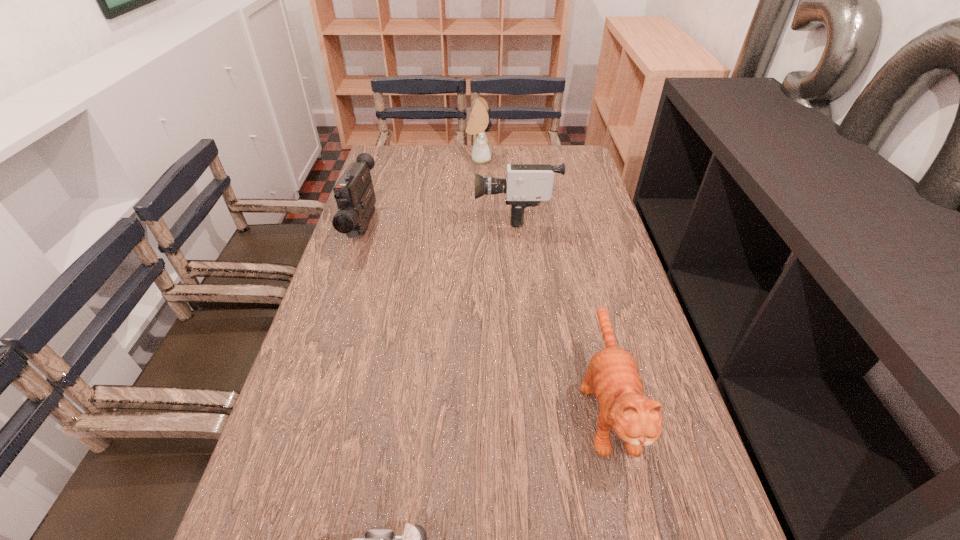
Find the location of a particular element. Image resolution: width=960 pixels, height=540 pixels. empty location between the rightmost camcorder and the leftmost object is located at coordinates (439, 220).

Find the location of a particular element. The width and height of the screenshot is (960, 540). vacant area that lies between the farthest object and the cat is located at coordinates (542, 281).

Identify the location of vacant point located between the leftmost camcorder and the rightmost camcorder. This screenshot has height=540, width=960. click(x=439, y=220).

Locate an element on the screen. The image size is (960, 540). vacant region between the cat and the leftmost camcorder is located at coordinates (485, 315).

Identify the location of unoccupied area between the farthest object and the cat. Image resolution: width=960 pixels, height=540 pixels. (542, 281).

I want to click on object that is the closest to the rightmost camcorder, so pyautogui.click(x=477, y=125).

Where is `object that stands as the fourth closest to the rightmost camcorder`? Image resolution: width=960 pixels, height=540 pixels. object that stands as the fourth closest to the rightmost camcorder is located at coordinates (414, 539).

Locate an element on the screen. This screenshot has width=960, height=540. camcorder object that ranks as the closest to the shortest camcorder is located at coordinates (354, 193).

Select which camcorder is the third closest to the farthest object. Please provide its 2D coordinates. Your answer should be formatted as a tuple, i.e. [(x, y)], where the tuple contains the x and y coordinates of a point satisfying the conditions above.

[(414, 539)]

The image size is (960, 540). Find the location of `vacant area that satisfies the following two spatial constraints: 1. on the recording direction of the rightmost camcorder; 2. on the front-facing side of the leftmost object`. vacant area that satisfies the following two spatial constraints: 1. on the recording direction of the rightmost camcorder; 2. on the front-facing side of the leftmost object is located at coordinates (516, 227).